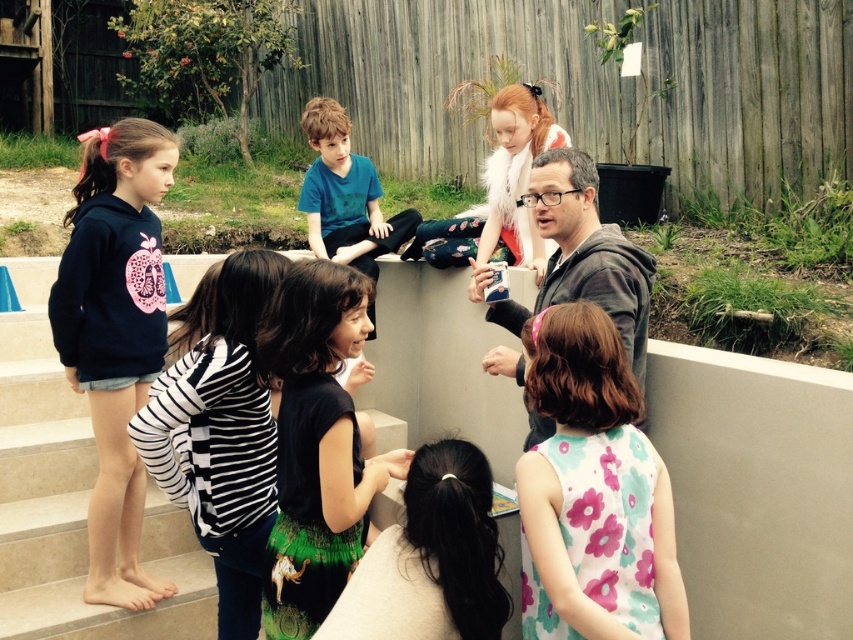
Question: Does floral sleeveless dress at lower right come behind black matte dress at center?

Choices:
 (A) no
 (B) yes

Answer: (A)

Question: Which point is farther to the camera?

Choices:
 (A) dark gray hoodie at center
 (B) floral sleeveless dress at lower right
 (C) black striped shirt at lower left

Answer: (C)

Question: Among these points, which one is nearest to the camera?

Choices:
 (A) (57, 536)
 (B) (601, 368)
 (C) (273, 273)

Answer: (B)

Question: Which point is farther to the camera?

Choices:
 (A) (85, 252)
 (B) (207, 355)
 (C) (291, 340)
 (D) (614, 323)

Answer: (A)

Question: Where is dark blue hoodie at left located in relation to blue cotton shirt at center in the image?

Choices:
 (A) above
 (B) below

Answer: (B)

Question: Is floral sleeveless dress at lower right closer to camera compared to black matte dress at center?

Choices:
 (A) no
 (B) yes

Answer: (B)